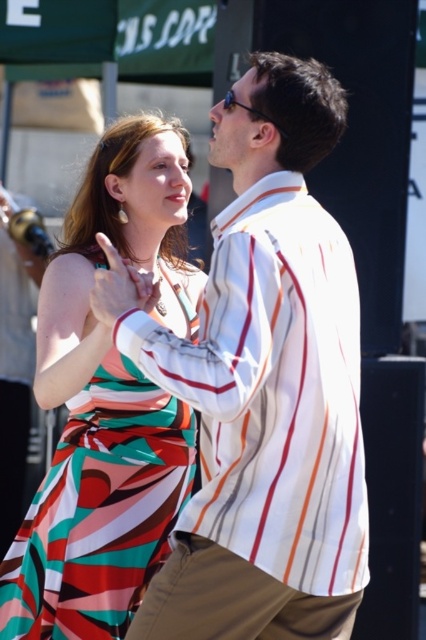
Question: Is multicolored striped dress at center positioned before khaki pants at lower center?

Choices:
 (A) no
 (B) yes

Answer: (A)

Question: Is white striped shirt at center thinner than multicolored striped dress at center?

Choices:
 (A) yes
 (B) no

Answer: (B)

Question: Which point appears farthest from the camera in this image?

Choices:
 (A) (120, 465)
 (B) (322, 609)

Answer: (A)

Question: Which point is closer to the camera taking this photo?

Choices:
 (A) (319, 372)
 (B) (327, 596)
 (C) (52, 576)

Answer: (A)

Question: Is multicolored striped dress at center closer to camera compared to khaki pants at lower center?

Choices:
 (A) yes
 (B) no

Answer: (B)

Question: Which of the following is the farthest from the observer?

Choices:
 (A) multicolored striped dress at center
 (B) khaki pants at lower center

Answer: (A)